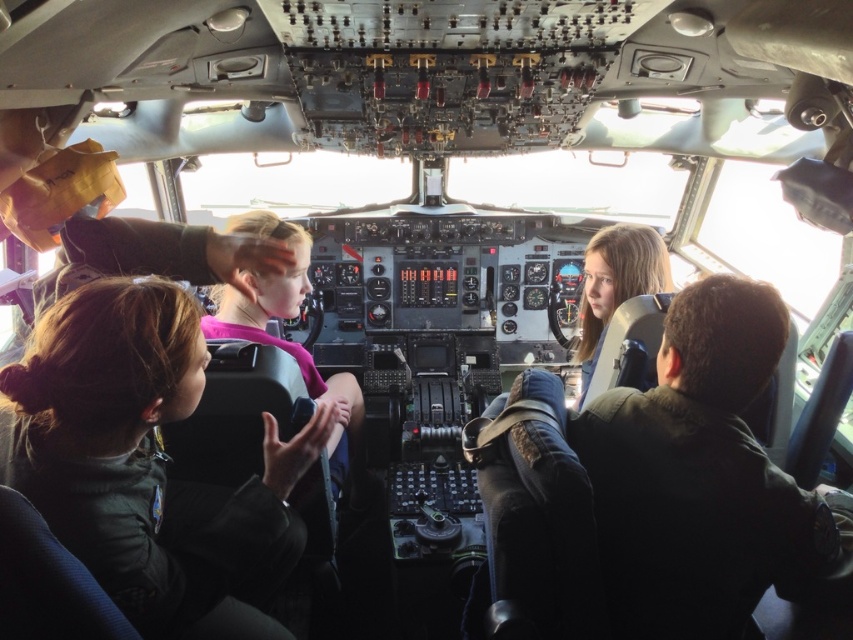
You are a flight attendant checking the cockpit for safety. You notice the dark green uniform at left and the dark brown leather jacket at center. Which one is nearer to you?

The dark green uniform at left is closer to the viewer than the dark brown leather jacket at center, so the dark green uniform at left is nearer to you.

You are a flight attendant checking the cockpit for safety compliance. You notice two crew members wearing the dark green uniform at left and the dark brown leather jacket at center. Which crew member is wearing clothing with a narrower width?

The dark green uniform at left has a narrower width than the dark brown leather jacket at center.